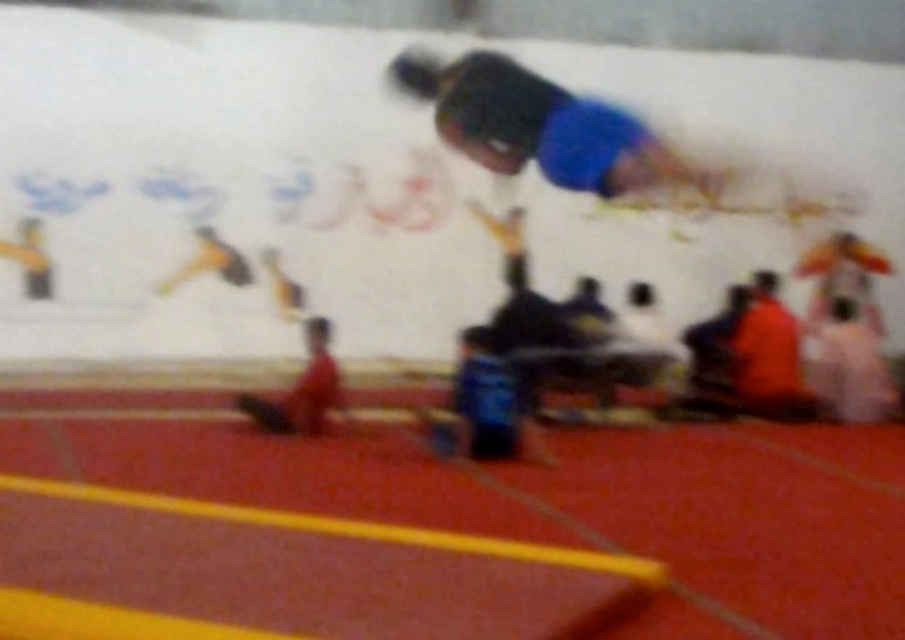
Is blue matte skateboard at upper center shorter than orange fabric shirt at right?

Incorrect, blue matte skateboard at upper center's height does not fall short of orange fabric shirt at right's.

Is blue matte skateboard at upper center to the right of orange fabric shirt at right from the viewer's perspective?

Incorrect, blue matte skateboard at upper center is not on the right side of orange fabric shirt at right.

Which is behind, point (408, 76) or point (770, 308)?

The point (408, 76) is more distant.

Find the location of `blue matte skateboard at upper center`. blue matte skateboard at upper center is located at coordinates (543, 128).